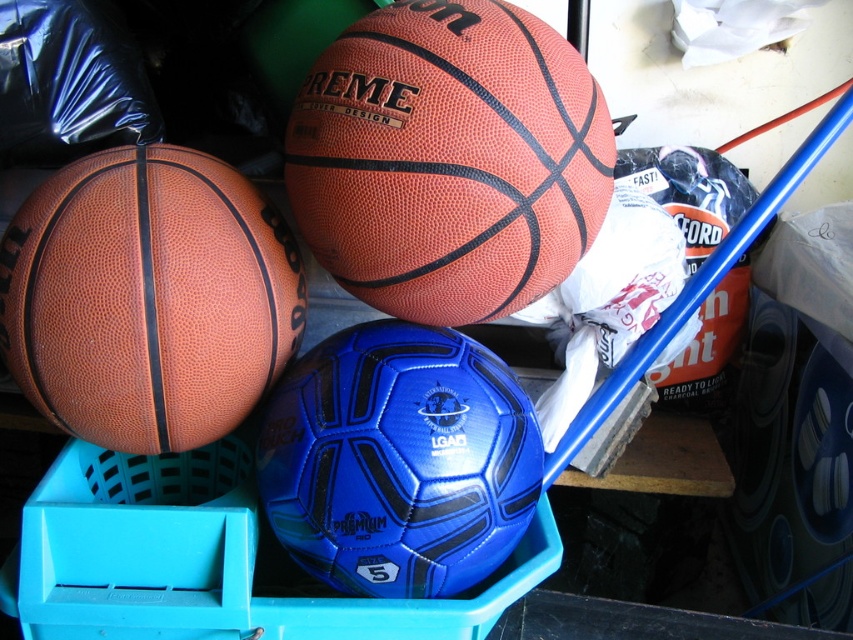
Can you confirm if leather basketball at center is positioned to the right of matte orange basketball at left?

Yes, leather basketball at center is to the right of matte orange basketball at left.

Is leather basketball at center above matte orange basketball at left?

Indeed, leather basketball at center is positioned over matte orange basketball at left.

Between point (439, 232) and point (149, 310), which one is positioned behind?

Positioned behind is point (439, 232).

Where is `leather basketball at center`? Image resolution: width=853 pixels, height=640 pixels. leather basketball at center is located at coordinates (450, 160).